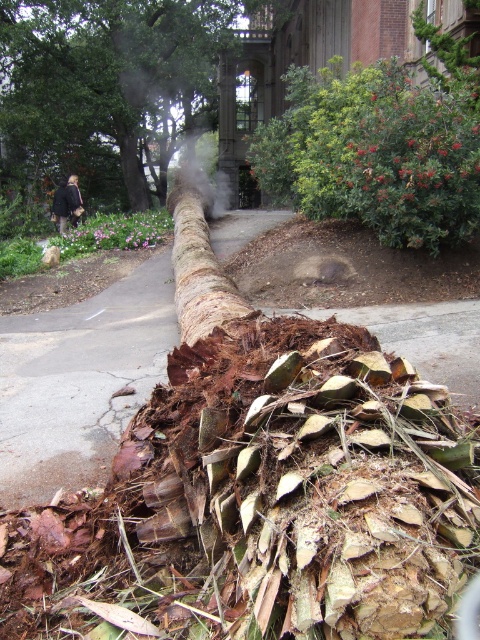
Can you confirm if brown rough bark at center is positioned below smooth brown log at center?

Actually, brown rough bark at center is above smooth brown log at center.

Does brown rough bark at center have a greater height compared to smooth brown log at center?

Yes.

Describe the element at coordinates (108, 84) in the screenshot. Image resolution: width=480 pixels, height=640 pixels. I see `brown rough bark at center` at that location.

Where is `brown rough bark at center`? brown rough bark at center is located at coordinates (108, 84).

Which is behind, point (178, 180) or point (71, 204)?

Positioned behind is point (178, 180).

Which of these two, white smoke at center or black coat at lower left, stands taller?

white smoke at center

The image size is (480, 640). What do you see at coordinates (202, 173) in the screenshot?
I see `white smoke at center` at bounding box center [202, 173].

The image size is (480, 640). I want to click on white smoke at center, so click(202, 173).

Describe the element at coordinates (80, 381) in the screenshot. This screenshot has width=480, height=640. I see `gray concrete pavement at center` at that location.

Who is taller, gray concrete pavement at center or white smoke at center?

white smoke at center is taller.

Find the location of a particular element. gray concrete pavement at center is located at coordinates (80, 381).

This screenshot has height=640, width=480. In order to click on gray concrete pavement at center in this screenshot , I will do [80, 381].